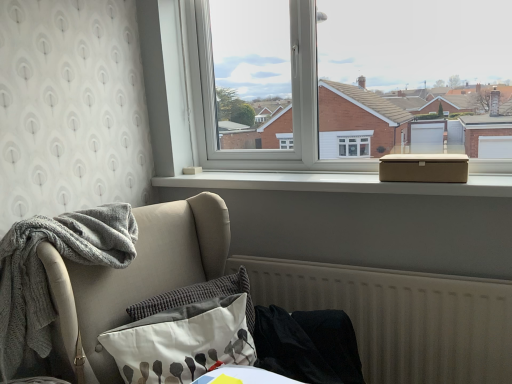
Find the location of `free space above beige textured radiator at lower right (from a real-world perspective)`. free space above beige textured radiator at lower right (from a real-world perspective) is located at coordinates (366, 262).